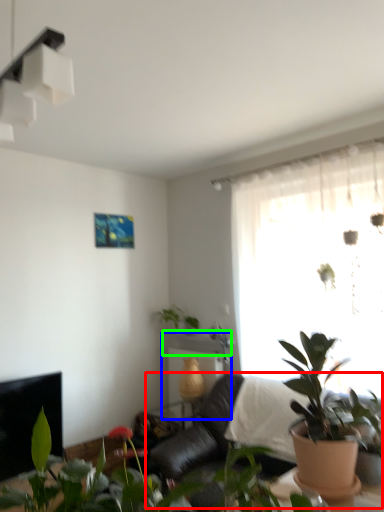
Question: Estimate the real-world distances between objects in this image. Which object is farther from couch (highlighted by a red box), table (highlighted by a blue box) or window sill (highlighted by a green box)?

Choices:
 (A) table
 (B) window sill

Answer: (B)